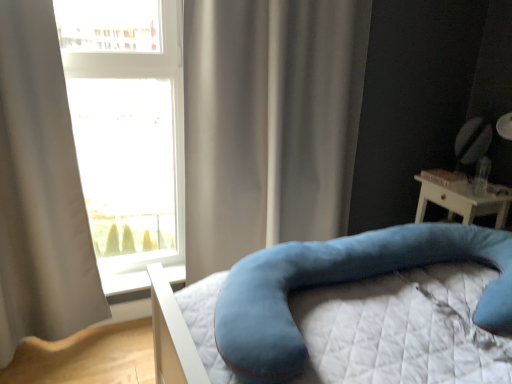
Question: Is satin beige curtain at center, the second curtain viewed from the left, shorter than white plastic window sill at lower left?

Choices:
 (A) no
 (B) yes

Answer: (A)

Question: From a real-world perspective, is satin beige curtain at center, which ranks as the first curtain in right-to-left order, positioned under white plastic window sill at lower left based on gravity?

Choices:
 (A) no
 (B) yes

Answer: (A)

Question: Is satin beige curtain at center, the second curtain viewed from the left, further to camera compared to white plastic window sill at lower left?

Choices:
 (A) no
 (B) yes

Answer: (A)

Question: Considering the relative sizes of satin beige curtain at center, the second curtain viewed from the left, and white plastic window sill at lower left in the image provided, is satin beige curtain at center, the second curtain viewed from the left, wider than white plastic window sill at lower left?

Choices:
 (A) no
 (B) yes

Answer: (B)

Question: Is satin beige curtain at center, which ranks as the first curtain in right-to-left order, taller than white plastic window sill at lower left?

Choices:
 (A) no
 (B) yes

Answer: (B)

Question: Looking at their shapes, would you say white plastic window sill at lower left is wider or thinner than velvety blue pillow at lower right?

Choices:
 (A) thin
 (B) wide

Answer: (A)

Question: From the image's perspective, relative to velvety blue pillow at lower right, is white plastic window sill at lower left above or below?

Choices:
 (A) above
 (B) below

Answer: (B)

Question: Considering the positions of white plastic window sill at lower left and velvety blue pillow at lower right in the image, is white plastic window sill at lower left bigger or smaller than velvety blue pillow at lower right?

Choices:
 (A) small
 (B) big

Answer: (A)

Question: Would you say white plastic window sill at lower left is inside or outside velvety blue pillow at lower right?

Choices:
 (A) inside
 (B) outside

Answer: (B)

Question: From the image's perspective, is white plastic window sill at lower left above or below transparent glass window at upper left?

Choices:
 (A) above
 (B) below

Answer: (B)

Question: Is point (175, 266) closer or farther from the camera than point (135, 279)?

Choices:
 (A) closer
 (B) farther

Answer: (B)

Question: Is white plastic window sill at lower left in front of or behind transparent glass window at upper left in the image?

Choices:
 (A) behind
 (B) front

Answer: (A)

Question: In the image, is white plastic window sill at lower left on the left side or the right side of transparent glass window at upper left?

Choices:
 (A) left
 (B) right

Answer: (A)

Question: Is light gray fabric curtain at left, which ranks as the 2th curtain in right-to-left order, bigger or smaller than velvety blue pillow at lower right?

Choices:
 (A) small
 (B) big

Answer: (B)

Question: From a real-world perspective, is light gray fabric curtain at left, which appears as the first curtain when viewed from the left, above or below velvety blue pillow at lower right?

Choices:
 (A) below
 (B) above

Answer: (B)